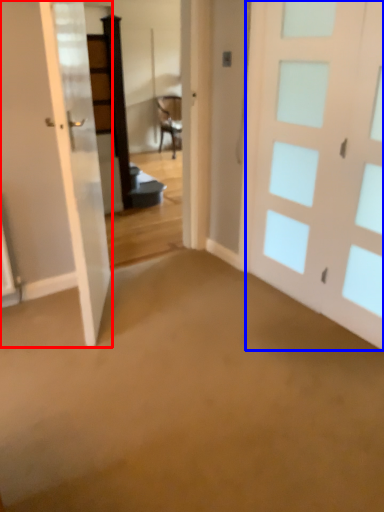
Question: Which object appears closest to the camera in this image, door (highlighted by a red box) or door (highlighted by a blue box)?

Choices:
 (A) door
 (B) door

Answer: (A)